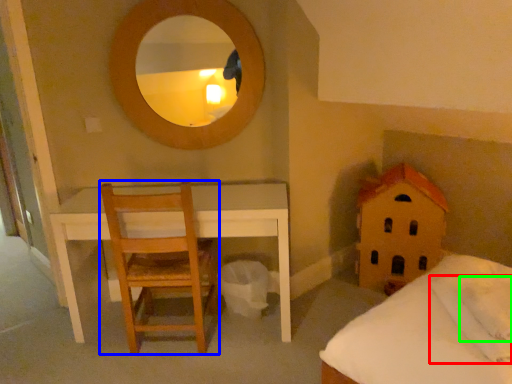
Question: Considering the real-world distances, which object is closest to pillow (highlighted by a red box)? chair (highlighted by a blue box) or pillow (highlighted by a green box).

Choices:
 (A) chair
 (B) pillow

Answer: (B)